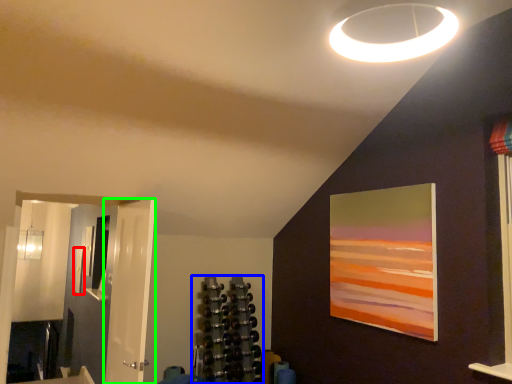
Question: Which object is positioned farthest from picture frame (highlighted by a red box)? Select from shelf (highlighted by a blue box) and door (highlighted by a green box).

Choices:
 (A) shelf
 (B) door

Answer: (B)